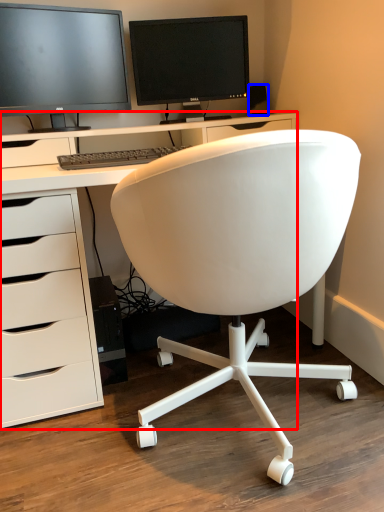
Question: Which object appears farthest to the camera in this image, desk (highlighted by a red box) or office supplies (highlighted by a blue box)?

Choices:
 (A) desk
 (B) office supplies

Answer: (B)